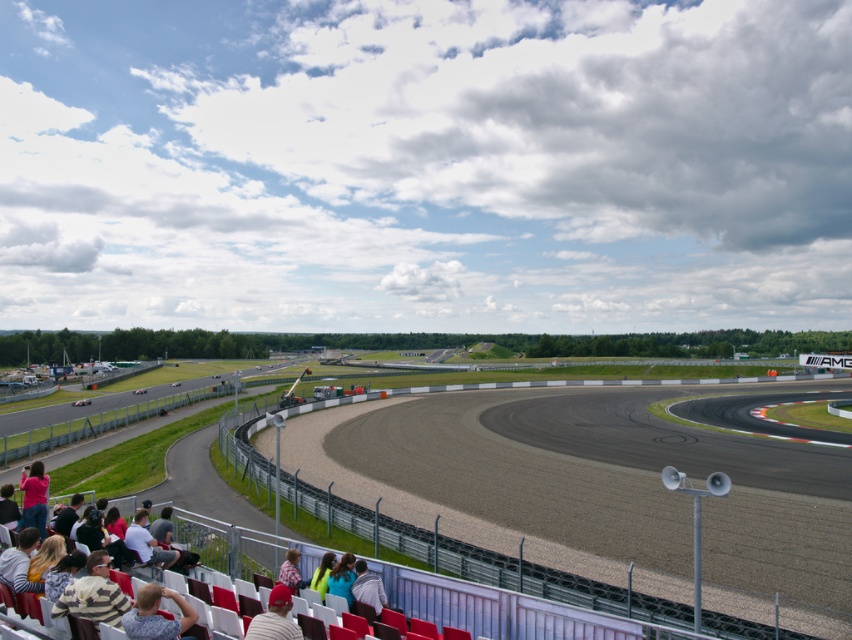
You are a photographer at the motorsport event and want to capture a photo of the light brown fabric jacket at lower center without the plaid shirt at lower center blocking it. Is this possible given their positions?

The light brown fabric jacket at lower center is positioned under the plaid shirt at lower center, so it is blocked by the plaid shirt. Therefore, it is not possible to capture the light brown fabric jacket at lower center without the plaid shirt at lower center blocking it.